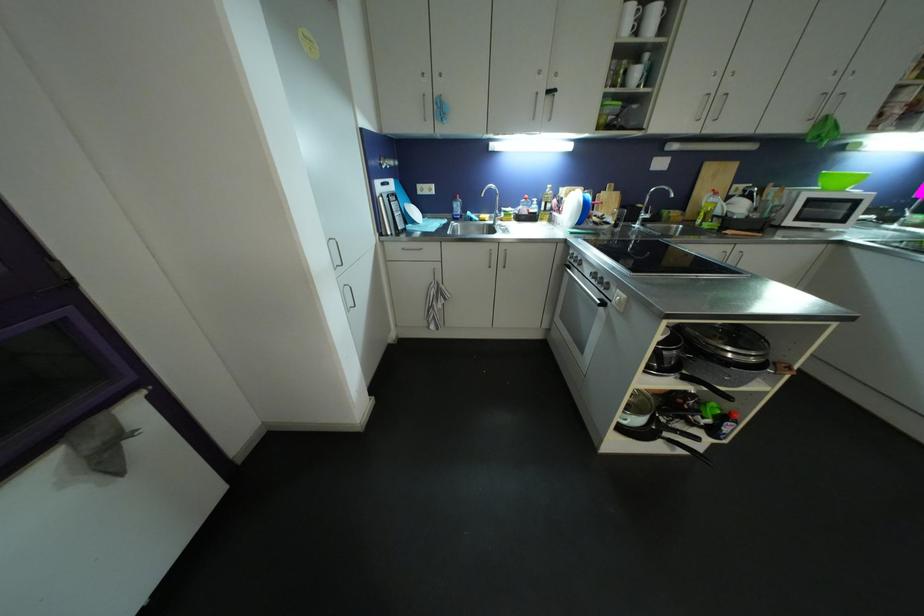
Where would you push the blue soap bottle? Please return your answer as a coordinate pair (x, y).

(456, 208)